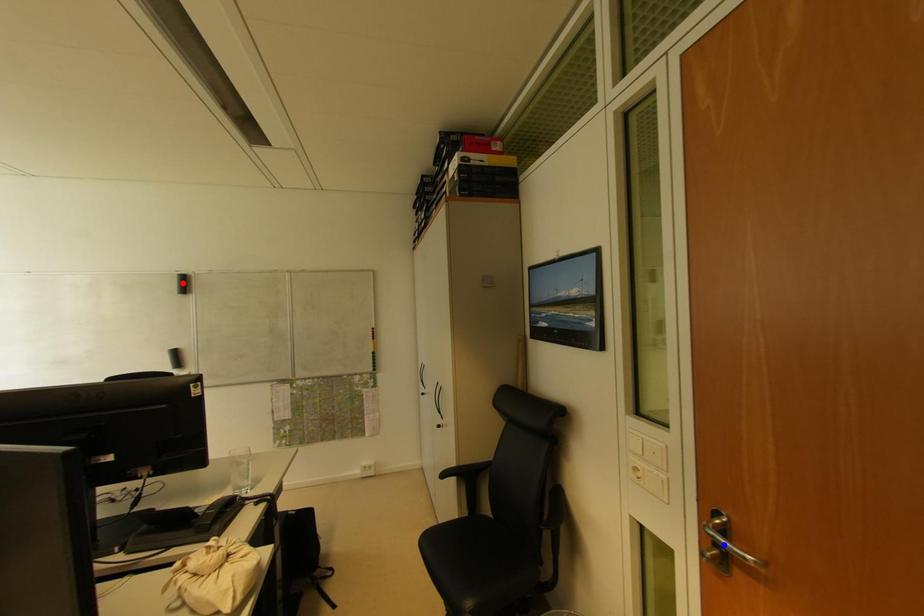
Question: In the image, two points are highlighted. Which point is nearer to the camera? Reply with the corresponding letter.

Choices:
 (A) blue point
 (B) red point

Answer: (A)